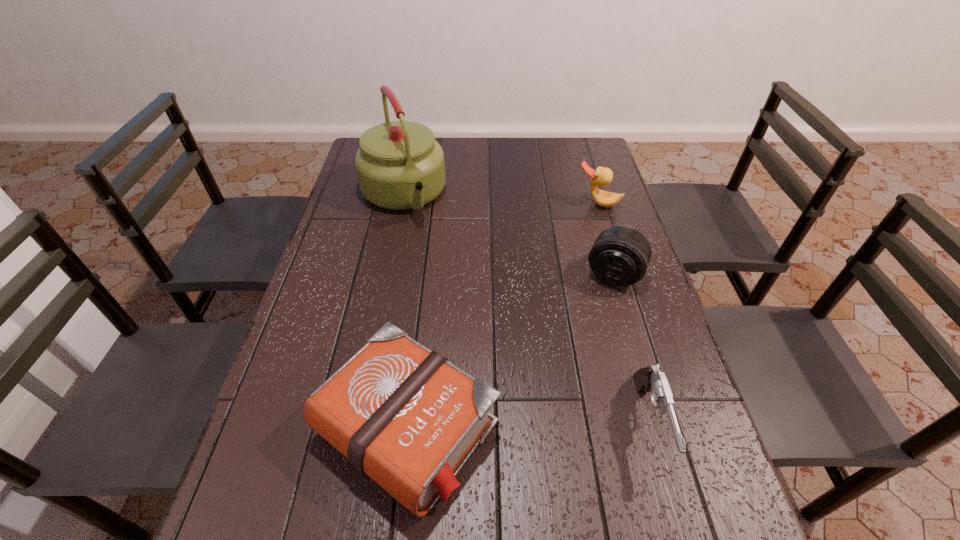
In order to click on vacant space on the desktop that is between the Bible and the gun and is positioned at the spout of the tallest object in this screenshot , I will do `click(519, 425)`.

Image resolution: width=960 pixels, height=540 pixels. In order to click on free space on the desktop that is between the Bible and the gun and is positioned on the front-facing side of the third farthest object in this screenshot , I will do `click(546, 424)`.

This screenshot has height=540, width=960. I want to click on free spot on the desktop that is between the Bible and the gun and is positioned on the beak of the duck, so click(496, 426).